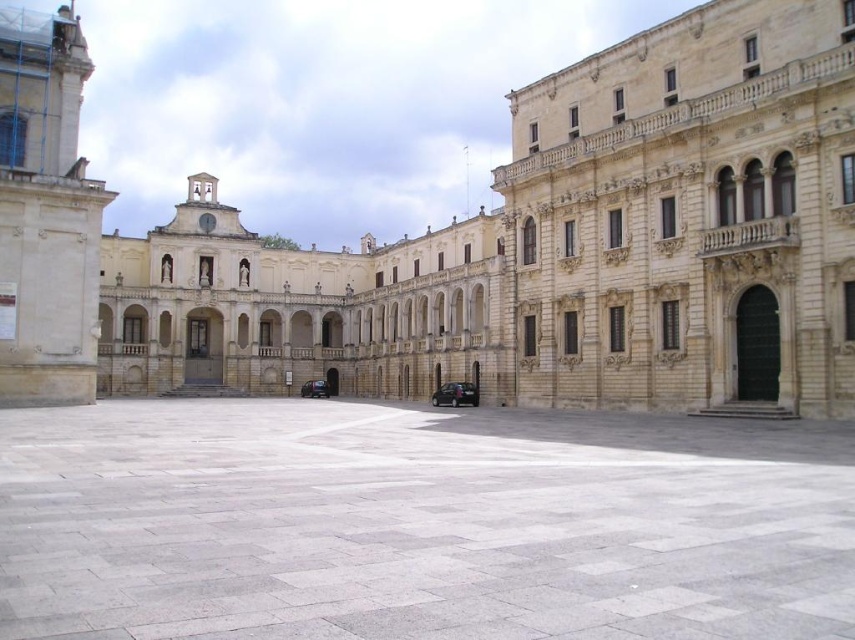
You are a tour guide explaining the historical building complex to visitors. You mention the gray stone courtyard at center and the shiny black car at center. Which of these two is shorter in height?

The gray stone courtyard at center is not as tall as the shiny black car at center, so the courtyard is shorter in height.

You are a tour guide explaining the historical building complex to visitors. You notice two cars parked in the square. Which car has a smaller width between the shiny black car at center and the shiny dark blue car at center?

The shiny black car at center has a smaller width compared to the shiny dark blue car at center according to the description.

You are standing at the entrance of the grand historical building and want to park your shiny black car at center. The parking spot is located at point [455,394]. Is the parking spot available?

The parking spot at point [455,394] is occupied by the shiny black car at center, so it is not available.